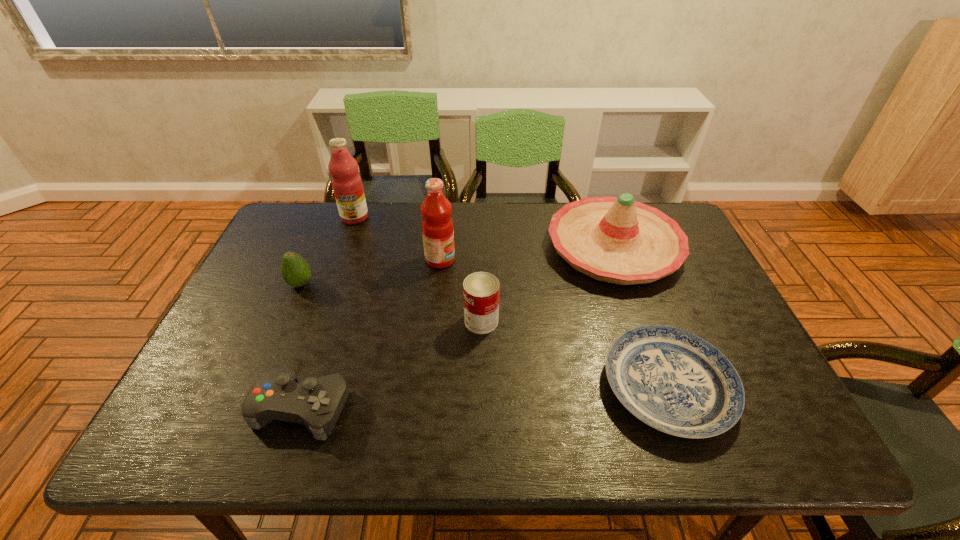
Locate an element on the screen. The width and height of the screenshot is (960, 540). control present at the near edge is located at coordinates (316, 403).

Locate an element on the screen. This screenshot has width=960, height=540. plate that is at the near edge is located at coordinates pos(674,381).

Image resolution: width=960 pixels, height=540 pixels. I want to click on object that is at the left edge, so click(295, 270).

This screenshot has width=960, height=540. What are the coordinates of `sombrero at the right edge` in the screenshot? It's located at (619, 240).

At what (x,y) coordinates should I click in order to perform the action: click on plate at the right edge. Please return your answer as a coordinate pair (x, y). The height and width of the screenshot is (540, 960). Looking at the image, I should click on (674, 381).

Image resolution: width=960 pixels, height=540 pixels. I want to click on object that is at the far right corner, so click(x=619, y=240).

Locate an element on the screen. This screenshot has width=960, height=540. object present at the near right corner is located at coordinates (674, 381).

In the image, there is a desktop. Where is `free region at the far edge`? free region at the far edge is located at coordinates (414, 246).

The height and width of the screenshot is (540, 960). I want to click on free point at the near edge, so click(522, 416).

Identify the location of free point at the left edge. The image size is (960, 540). (280, 253).